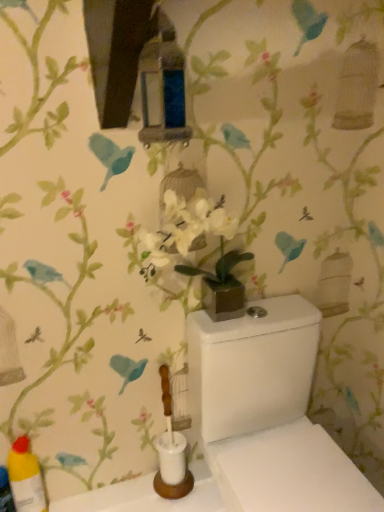
Question: Should I look upward or downward to see white glossy toilet at center?

Choices:
 (A) up
 (B) down

Answer: (B)

Question: Is yellow plastic bottle at lower left shorter than white glossy toilet at center?

Choices:
 (A) yes
 (B) no

Answer: (A)

Question: Is yellow plastic bottle at lower left bigger than white glossy toilet at center?

Choices:
 (A) no
 (B) yes

Answer: (A)

Question: Would you say yellow plastic bottle at lower left contains white glossy toilet at center?

Choices:
 (A) yes
 (B) no

Answer: (B)

Question: Are yellow plastic bottle at lower left and white glossy toilet at center far apart?

Choices:
 (A) yes
 (B) no

Answer: (B)

Question: Is yellow plastic bottle at lower left outside white glossy toilet at center?

Choices:
 (A) no
 (B) yes

Answer: (B)

Question: Is the position of yellow plastic bottle at lower left less distant than that of white glossy toilet at center?

Choices:
 (A) no
 (B) yes

Answer: (A)

Question: Can you confirm if white glossy toilet at center is thinner than yellow plastic bottle at lower left?

Choices:
 (A) yes
 (B) no

Answer: (B)

Question: From a real-world perspective, is white glossy toilet at center below yellow plastic bottle at lower left?

Choices:
 (A) no
 (B) yes

Answer: (A)

Question: From the image's perspective, is white glossy toilet at center over yellow plastic bottle at lower left?

Choices:
 (A) yes
 (B) no

Answer: (A)

Question: Does white glossy toilet at center have a greater height compared to yellow plastic bottle at lower left?

Choices:
 (A) yes
 (B) no

Answer: (A)

Question: Could you tell me if white glossy toilet at center is turned towards yellow plastic bottle at lower left?

Choices:
 (A) no
 (B) yes

Answer: (A)

Question: Considering the relative sizes of white glossy toilet at center and yellow plastic bottle at lower left in the image provided, is white glossy toilet at center smaller than yellow plastic bottle at lower left?

Choices:
 (A) no
 (B) yes

Answer: (A)

Question: Considering their positions, is yellow plastic bottle at lower left located in front of or behind white glossy toilet at center?

Choices:
 (A) behind
 (B) front

Answer: (A)